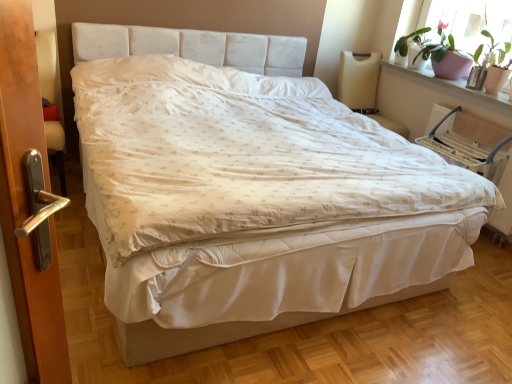
Question: Visually, is beige fabric armchair at upper right, the second armchair in the right-to-left sequence, positioned to the left or to the right of white fabric bed frame at center?

Choices:
 (A) right
 (B) left

Answer: (A)

Question: From the image's perspective, is beige fabric armchair at upper right, the second armchair in the right-to-left sequence, located above or below white fabric bed frame at center?

Choices:
 (A) below
 (B) above

Answer: (B)

Question: Estimate the real-world distances between objects in this image. Which object is farther from the pink ceramic pot at upper right?

Choices:
 (A) white fabric armchair at right, the 1th armchair viewed from the right
 (B) beige fabric armchair at upper right, the 1th armchair from the left
 (C) pink ceramic pot at upper right
 (D) white fabric bed frame at center

Answer: (D)

Question: Considering the real-world distances, which object is farthest from the pink ceramic pot at upper right?

Choices:
 (A) white fabric armchair at right, marked as the 2th armchair in a left-to-right arrangement
 (B) white fabric bed frame at center
 (C) pink ceramic pot at upper right
 (D) beige fabric armchair at upper right, the 1th armchair from the left

Answer: (B)